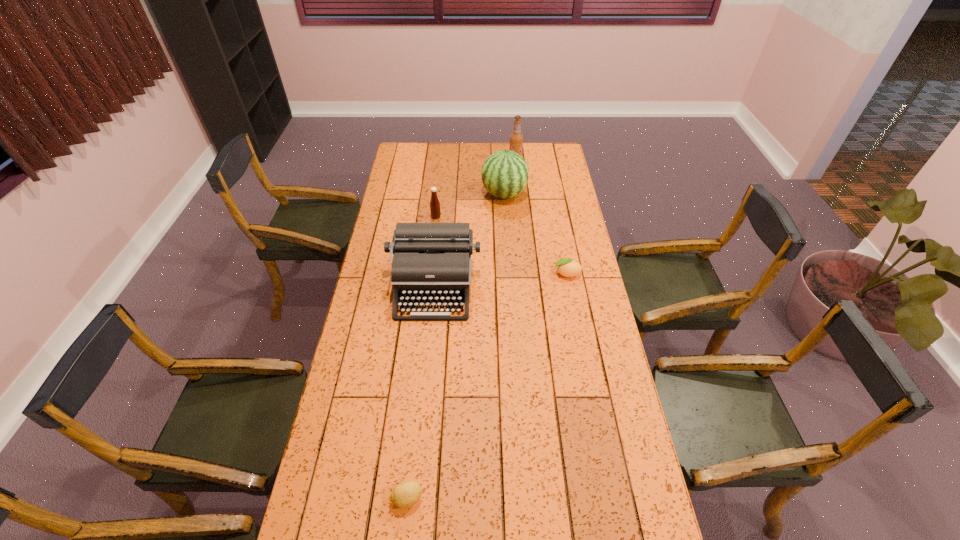
At what (x,y) coordinates should I click in order to perform the action: click on blank region between the farthest object and the farther lemon. Please return your answer as a coordinate pair (x, y). Looking at the image, I should click on (540, 217).

Find the location of `free space between the fourth tallest object and the second farthest object`. free space between the fourth tallest object and the second farthest object is located at coordinates (470, 206).

Image resolution: width=960 pixels, height=540 pixels. In order to click on unoccupied position between the rightmost object and the typewriter in this screenshot , I will do `click(500, 281)`.

Find the location of a particular element. The width and height of the screenshot is (960, 540). object that is the third closest one to the left lemon is located at coordinates (435, 211).

Identify which object is the second nearest to the nearer lemon. Please provide its 2D coordinates. Your answer should be formatted as a tuple, i.e. [(x, y)], where the tuple contains the x and y coordinates of a point satisfying the conditions above.

[(567, 267)]

Identify the location of lemon that stands as the second closest to the watermelon. Image resolution: width=960 pixels, height=540 pixels. (407, 493).

At what (x,y) coordinates should I click in order to perform the action: click on vacant position in the image that satisfies the following two spatial constraints: 1. with leaves positioned above the rightmost object; 2. on the typing side of the typewriter. Please return your answer as a coordinate pair (x, y). The height and width of the screenshot is (540, 960). Looking at the image, I should click on (569, 288).

You are a GUI agent. You are given a task and a screenshot of the screen. Output one action in this format:
    pyautogui.click(x=<x>, y=<y>)
    Task: Click on the vacant point that satisfies the following two spatial constraints: 1. on the back side of the watermelon; 2. on the right side of the fourth tallest object
    Image resolution: width=960 pixels, height=540 pixels.
    Given the screenshot: What is the action you would take?
    pyautogui.click(x=439, y=194)